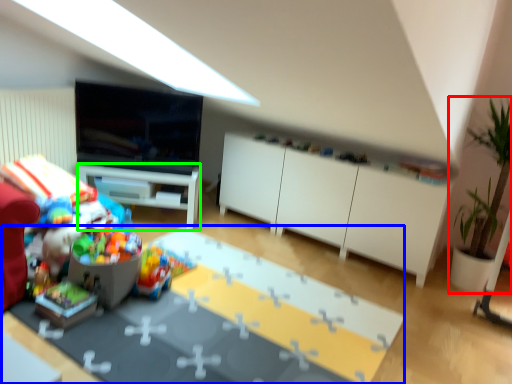
Question: Which object is positioned closest to houseplant (highlighted by a red box)? Select from table (highlighted by a blue box) and desk (highlighted by a green box).

Choices:
 (A) table
 (B) desk

Answer: (A)